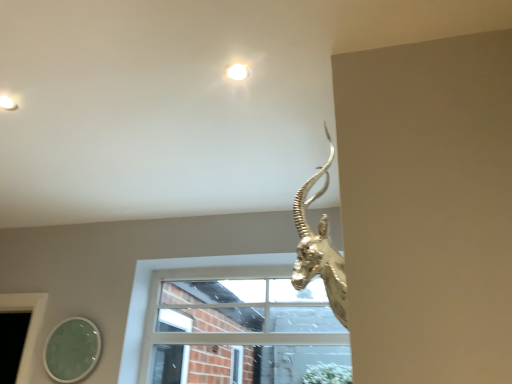
Question: Looking at their shapes, would you say green glass mirror at lower left is wider or thinner than white glass window at center?

Choices:
 (A) thin
 (B) wide

Answer: (A)

Question: In the image, is green glass mirror at lower left on the left side or the right side of white glass window at center?

Choices:
 (A) left
 (B) right

Answer: (A)

Question: Based on their relative distances, which object is nearer to the green glass mirror at lower left?

Choices:
 (A) gold metallic antelope head at upper right
 (B) white glass window at center

Answer: (B)

Question: Which is farther from the white glass window at center?

Choices:
 (A) green glass mirror at lower left
 (B) gold metallic antelope head at upper right

Answer: (B)